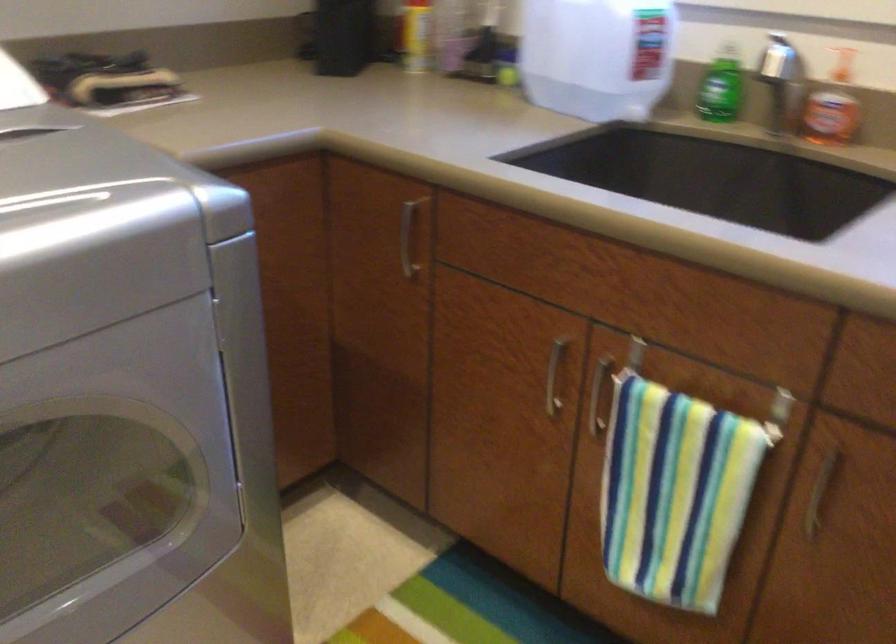
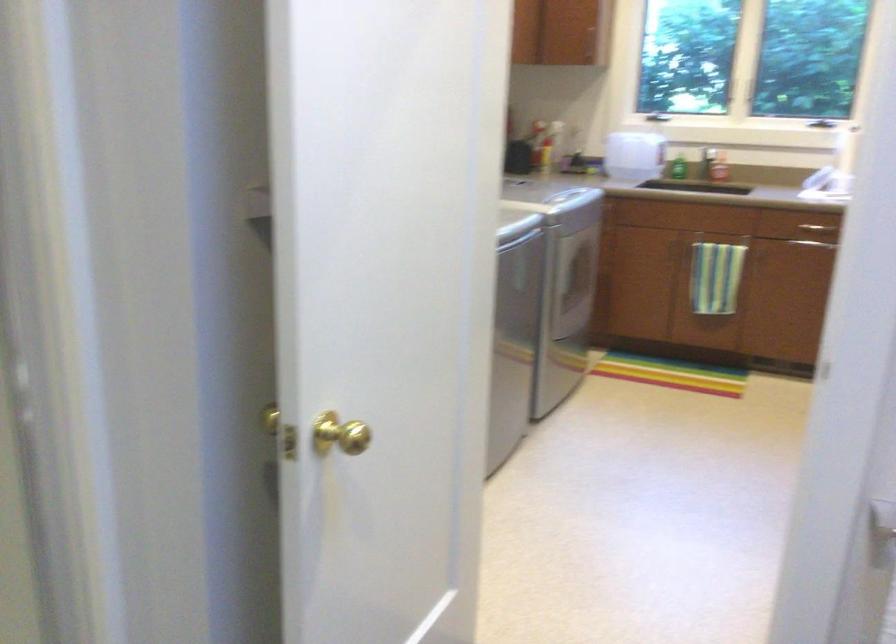
In a continuous first-person perspective shot, in which direction is the camera moving?

The cameraman walked toward left, backward.